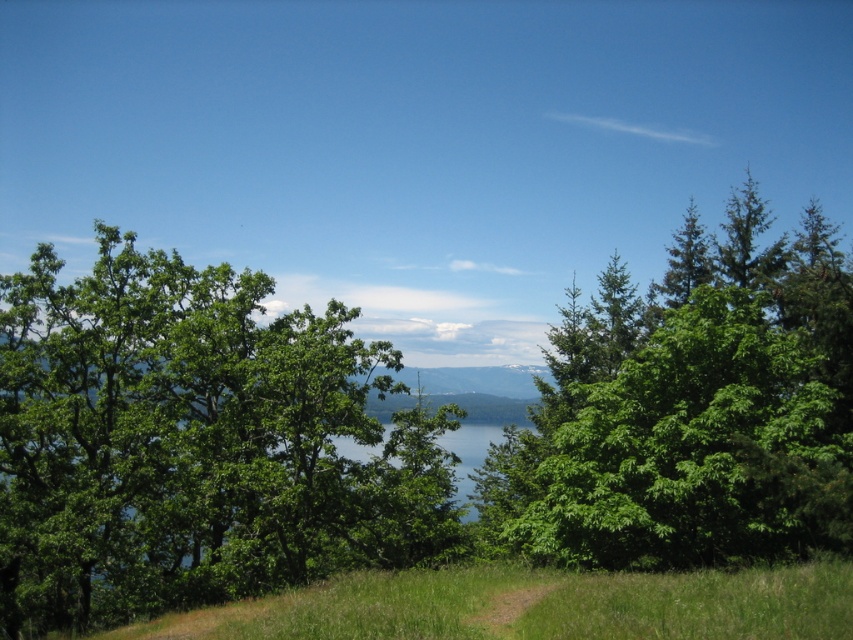
Question: Which of the following is the farthest from the observer?

Choices:
 (A) green leafy tree at center
 (B) green leafy tree at right

Answer: (A)

Question: Observing the image, what is the correct spatial positioning of green leafy tree at center in reference to green leafy tree at right?

Choices:
 (A) above
 (B) below

Answer: (B)

Question: Does green leafy tree at center appear over green leafy tree at right?

Choices:
 (A) no
 (B) yes

Answer: (A)

Question: Observing the image, what is the correct spatial positioning of green leafy tree at center in reference to green leafy tree at right?

Choices:
 (A) below
 (B) above

Answer: (A)

Question: Which point is closer to the camera taking this photo?

Choices:
 (A) (194, 573)
 (B) (590, 333)

Answer: (A)

Question: Which point is farther to the camera?

Choices:
 (A) (189, 550)
 (B) (633, 506)

Answer: (A)